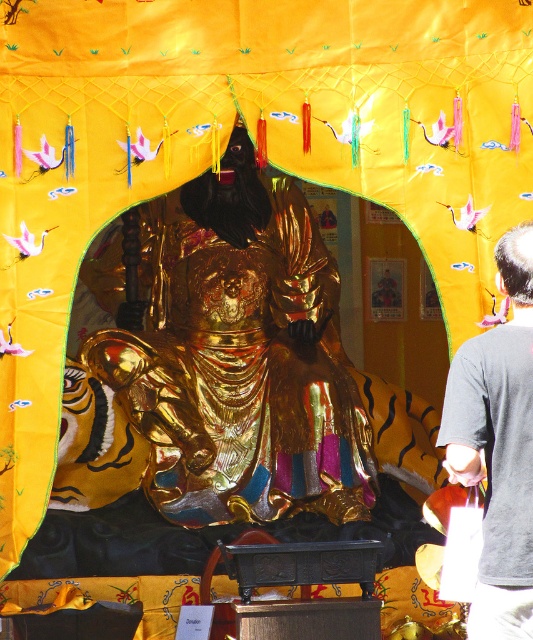
Between gold shiny statue at center and dark gray shirt at right, which one appears on the left side from the viewer's perspective?

gold shiny statue at center

Does gold shiny statue at center have a smaller size compared to dark gray shirt at right?

Actually, gold shiny statue at center might be larger than dark gray shirt at right.

Is point (203, 522) positioned before point (523, 417)?

No, it is behind (523, 417).

Locate an element on the screen. Image resolution: width=533 pixels, height=640 pixels. gold shiny statue at center is located at coordinates (238, 356).